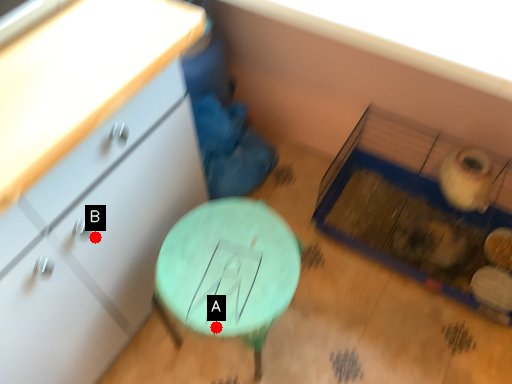
Question: Two points are circled on the image, labeled by A and B beside each circle. Which of the following is the farthest from the observer?

Choices:
 (A) A is further
 (B) B is further

Answer: (A)